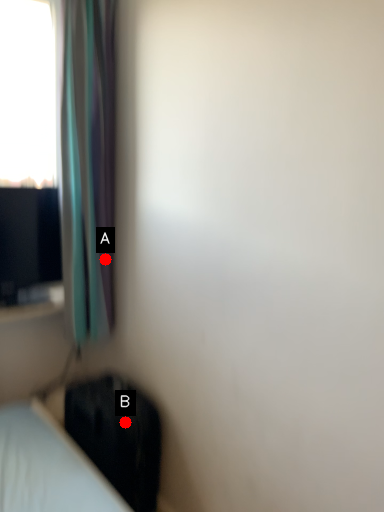
Question: Two points are circled on the image, labeled by A and B beside each circle. Which point is closer to the camera?

Choices:
 (A) A is closer
 (B) B is closer

Answer: (B)